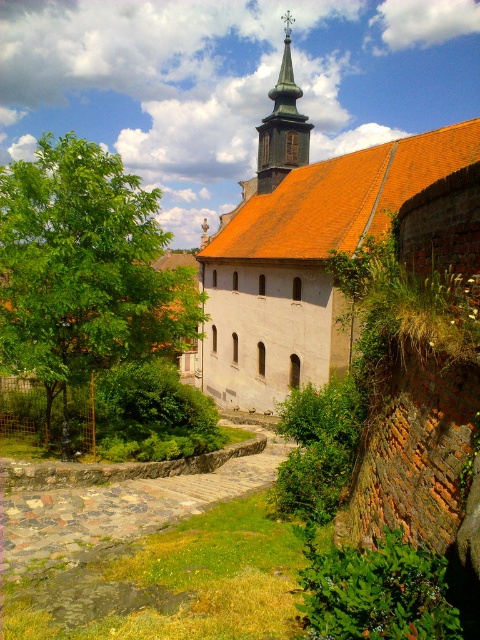
Question: Which point appears closest to the camera in this image?

Choices:
 (A) (287, 26)
 (B) (187, 323)

Answer: (B)

Question: Which object is the farthest from the green wooden spire at upper center?

Choices:
 (A) green leafy tree at left
 (B) orange tiled roof at center

Answer: (A)

Question: Among these objects, which one is nearest to the camera?

Choices:
 (A) green wooden spire at upper center
 (B) orange tiled roof at center
 (C) green leafy tree at left

Answer: (C)

Question: Can you confirm if orange tiled roof at center is positioned to the left of green leafy tree at left?

Choices:
 (A) yes
 (B) no

Answer: (B)

Question: Can you confirm if orange tiled roof at center is positioned to the left of green leafy tree at left?

Choices:
 (A) no
 (B) yes

Answer: (A)

Question: Does green leafy tree at left have a larger size compared to green wooden spire at upper center?

Choices:
 (A) yes
 (B) no

Answer: (A)